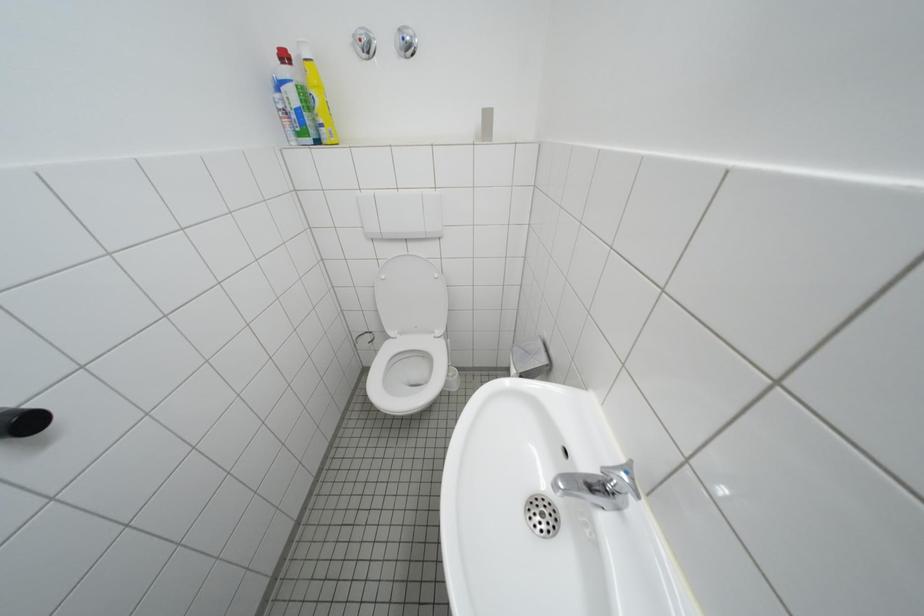
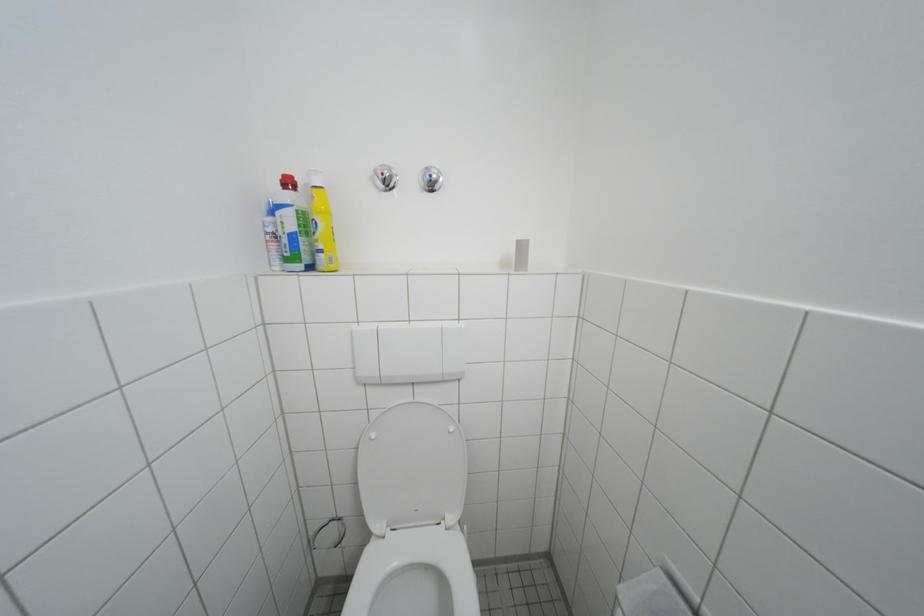
Question: The images are taken continuously from a first-person perspective. In which direction is your viewpoint rotating?

Choices:
 (A) Left
 (B) Right
 (C) Up
 (D) Down

Answer: (C)